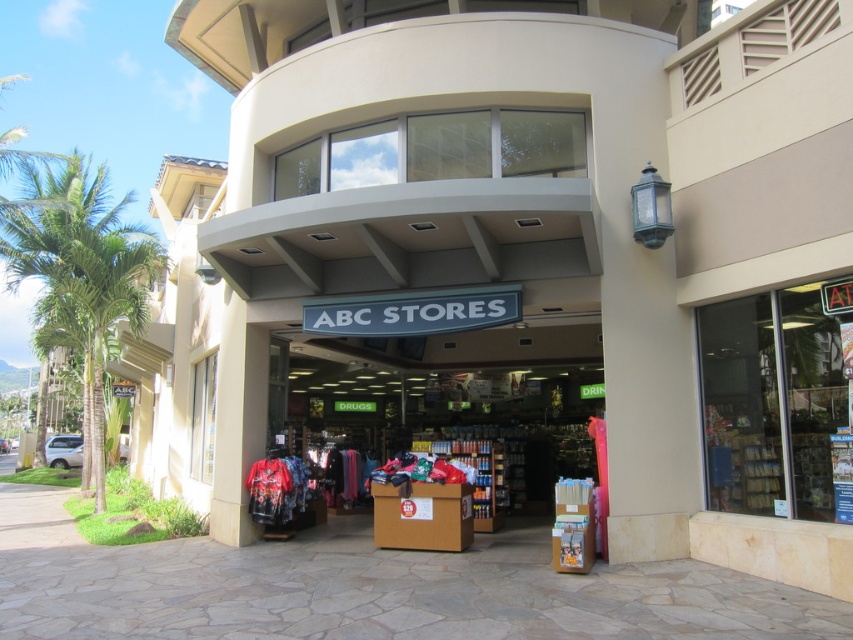
Which is more to the right, clear glass door at center or green leafy palm tree at left?

From the viewer's perspective, clear glass door at center appears more on the right side.

Can you confirm if clear glass door at center is positioned below green leafy palm tree at left?

Yes, clear glass door at center is below green leafy palm tree at left.

Who is more forward, [791,516] or [55,300]?

Point [791,516] is in front.

Find the location of `clear glass door at center`. clear glass door at center is located at coordinates (775, 404).